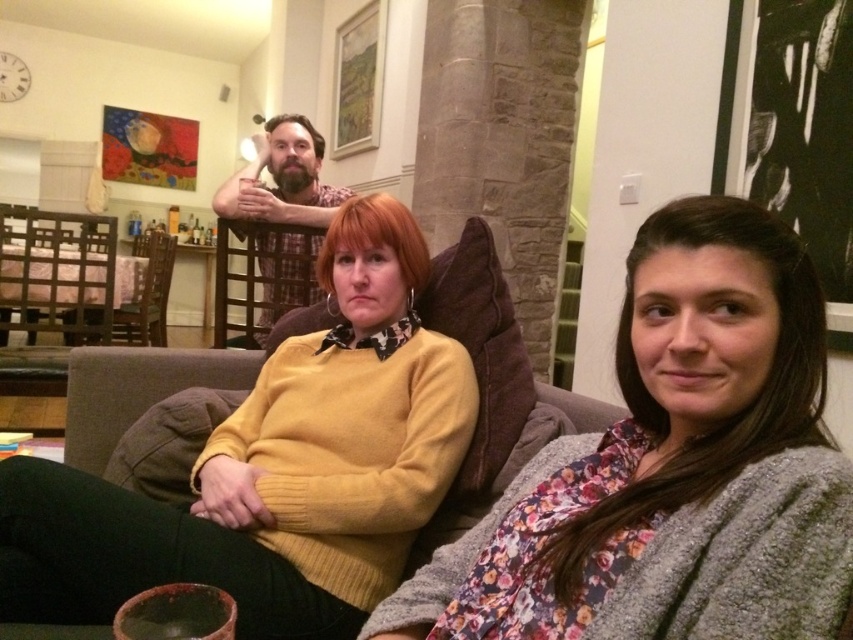
You are a photographer setting up for a group photo. You need to ensure that the floral fabric sweater at center and the yellow knit sweater at center are at least 20 inches apart for proper framing. Based on the scene description, will their current distance meet this requirement?

The floral fabric sweater at center and the yellow knit sweater at center are 21.65 inches apart from each other, which exceeds the minimum requirement of 20 inches. Therefore, their current distance meets the requirement for proper framing.

You are standing in the living room and want to take a photo of the two points. Which point, point (x=451, y=385) or point (x=146, y=342), is closer to the camera?

Point (x=451, y=385) is closer to the camera than point (x=146, y=342).

You are a photographer setting up for a group photo in this living room. You need to position yourself so that both the yellow knit sweater at center and the woodenchair at left are in your frame. Which object should you focus on first to ensure both are in focus?

The yellow knit sweater at center is closer to the viewer than the woodenchair at left. To ensure both are in focus, you should focus on the yellow knit sweater at center first, as it is the closer object, and then adjust to include the woodenchair at left in the frame.